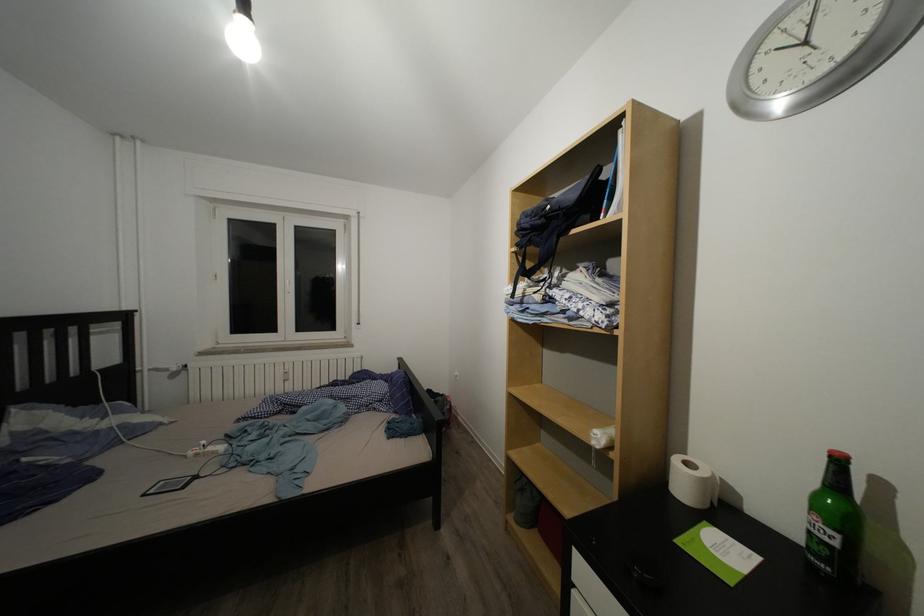
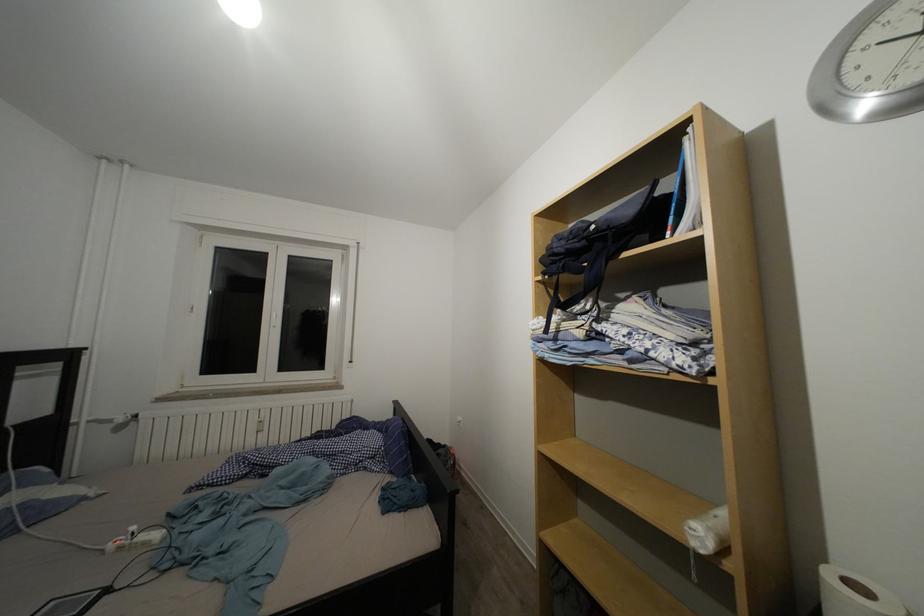
Where in the second image is the point corresponding to [211,448] from the first image?

(140, 533)